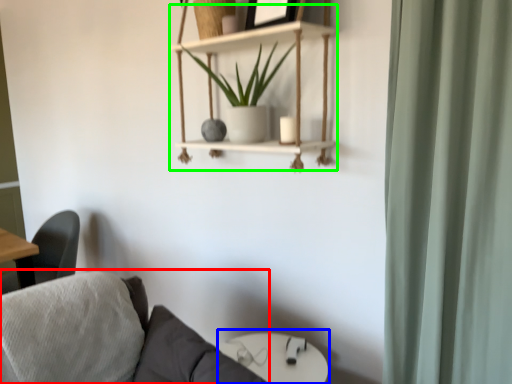
Question: Based on their relative distances, which object is nearer to studio couch (highlighted by a red box)? Choose from round table (highlighted by a blue box) and cabinet (highlighted by a green box).

Choices:
 (A) round table
 (B) cabinet

Answer: (A)